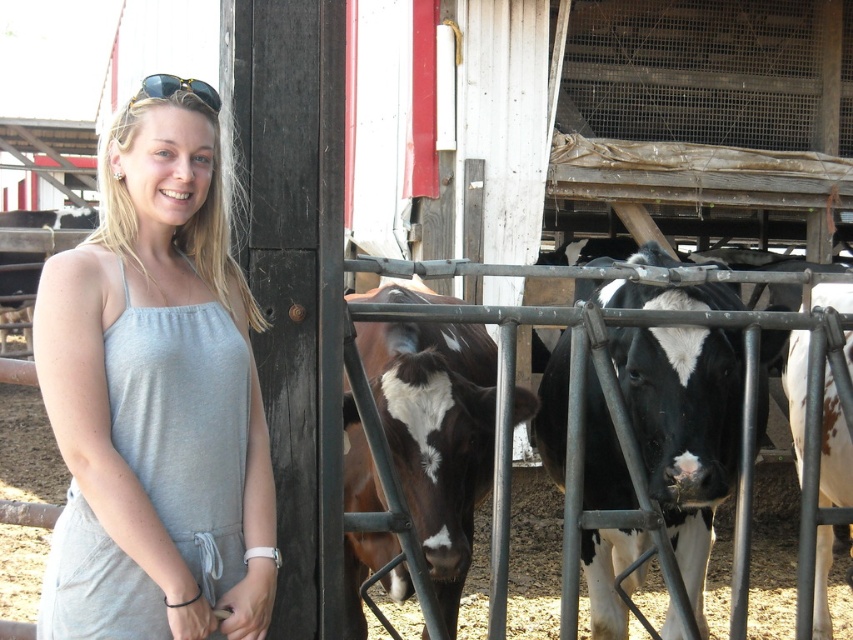
You are a photographer trying to capture a clear image of both the gray fabric dress at center and the black and white fur at center. Since you want both subjects to be fully visible in the frame, which one should you focus on first to ensure it is in focus?

The gray fabric dress at center has a lesser height compared to black and white fur at center, so you should focus on the black and white fur at center first because it is taller and requires more attention to ensure it is fully in focus.

You are standing at the point with coordinates point (115, 586) and want to walk to point (636, 552). Which direction should you move in to reach your destination?

To reach point (636, 552) from point (115, 586), you should move backward since point (115, 586) is in front of point (636, 552).